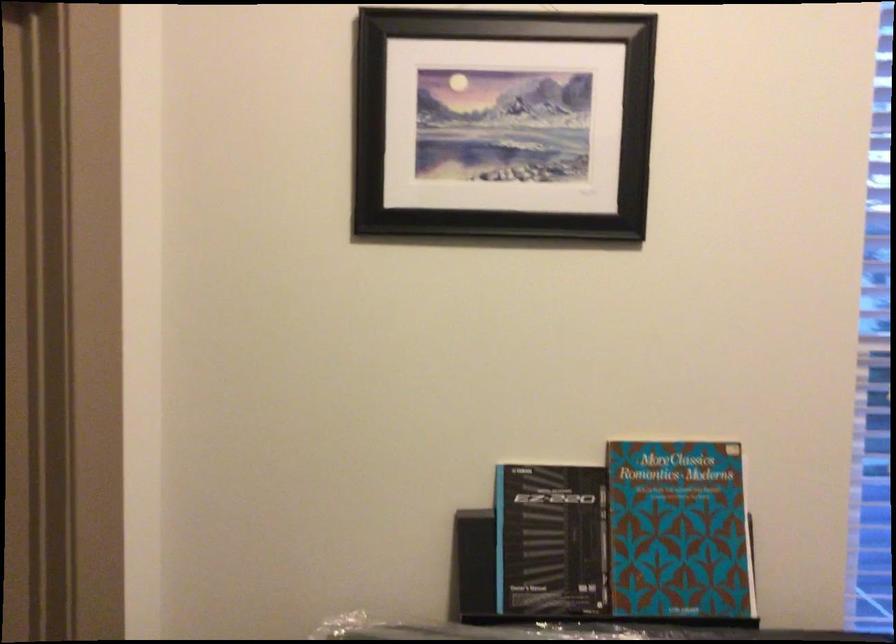
This screenshot has width=896, height=644. Identify the location of black booklet. (549, 540).